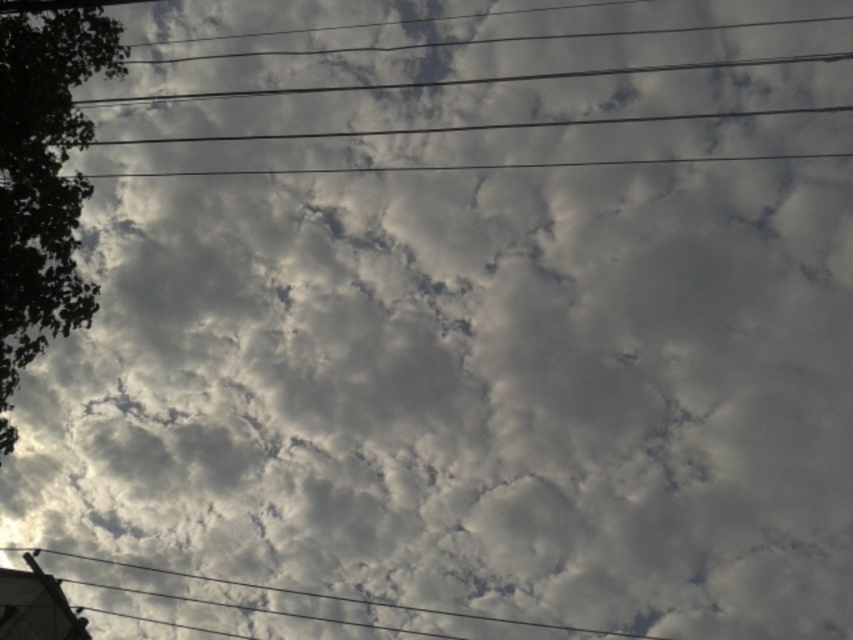
You are standing at the base of the green leafy tree at left. You want to take a photo of the tree and the clouds in the sky behind it. How far back should you move to ensure the entire tree and the clouds are in frame?

Since the green leafy tree at left is 84.48 feet away from the viewer, you should move back approximately 84.48 feet to ensure the entire tree and the clouds in the sky behind it are in frame.